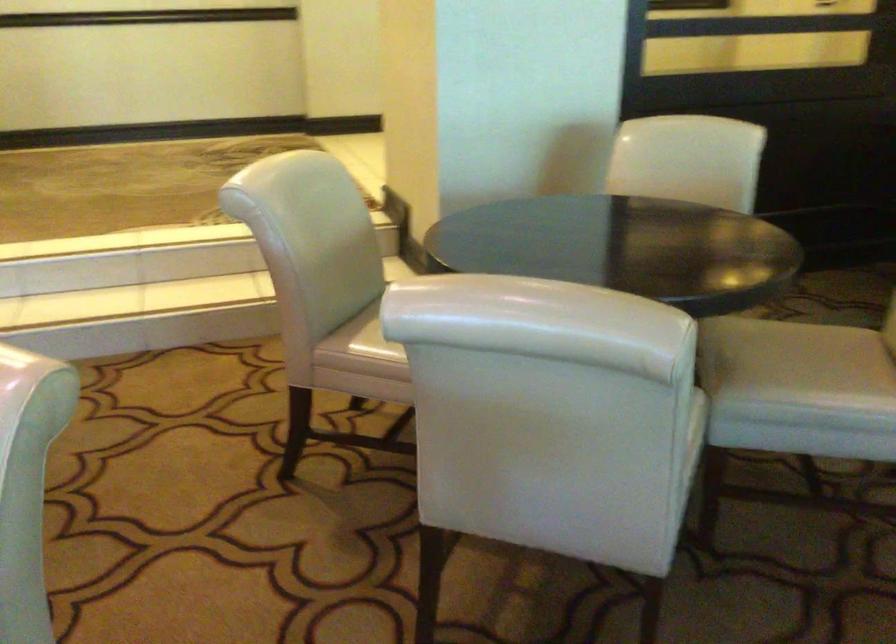
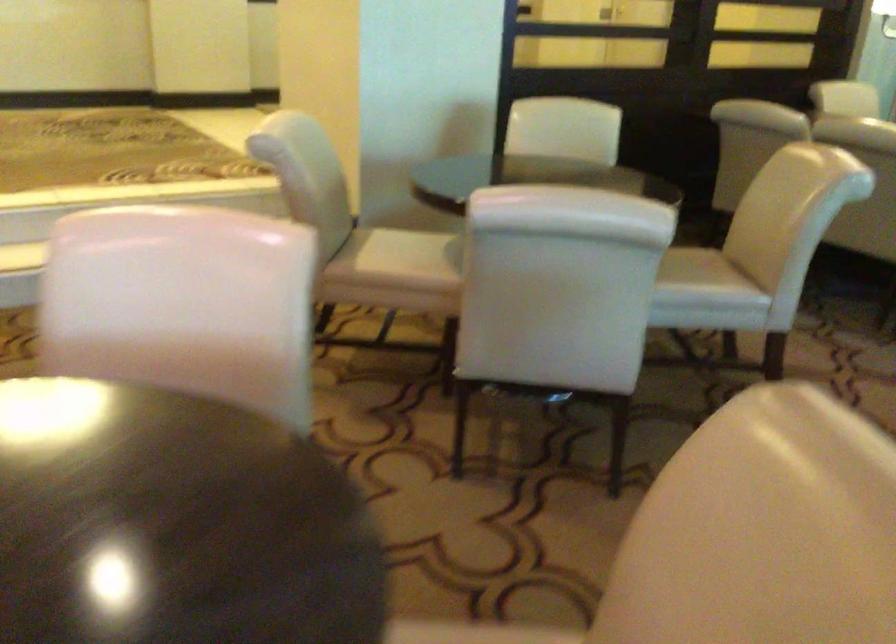
Question: The images are taken continuously from a first-person perspective. In which direction is your viewpoint rotating?

Choices:
 (A) Left
 (B) Right
 (C) Up
 (D) Down

Answer: (B)